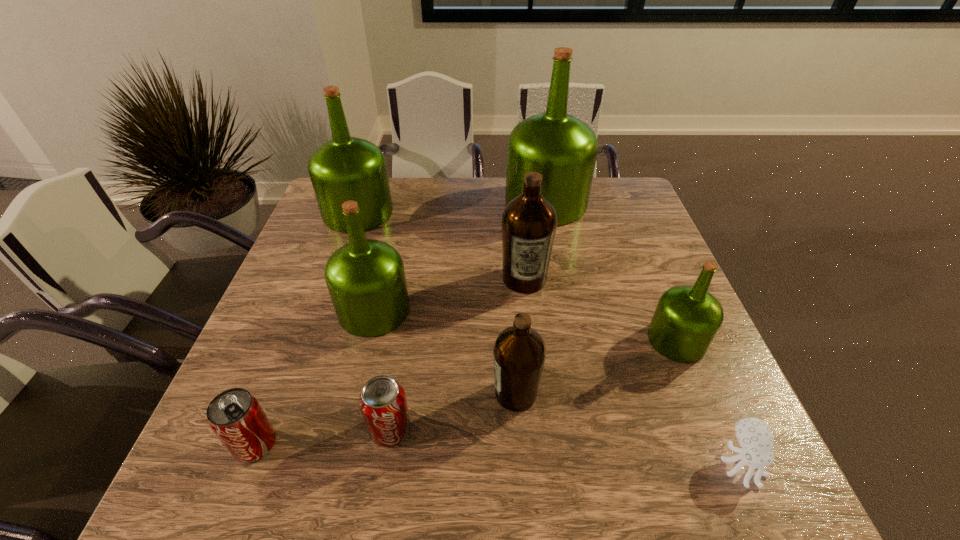
This screenshot has height=540, width=960. In order to click on green olive oil that is the fourth closest one to the white octopus in this screenshot , I will do point(345,168).

Identify the location of green olive oil that is the second closest to the third biggest green olive oil. This screenshot has height=540, width=960. (563, 149).

This screenshot has height=540, width=960. Identify the location of free location that satisfies the following two spatial constraints: 1. on the label of the farther brown olive oil; 2. on the label of the nearer brown olive oil. (537, 394).

I want to click on vacant area in the image that satisfies the following two spatial constraints: 1. on the front side of the right soda can; 2. on the right side of the third smallest green olive oil, so click(x=282, y=429).

The image size is (960, 540). I want to click on vacant space that satisfies the following two spatial constraints: 1. on the back side of the second smallest green olive oil; 2. on the right side of the tallest olive oil, so click(x=399, y=203).